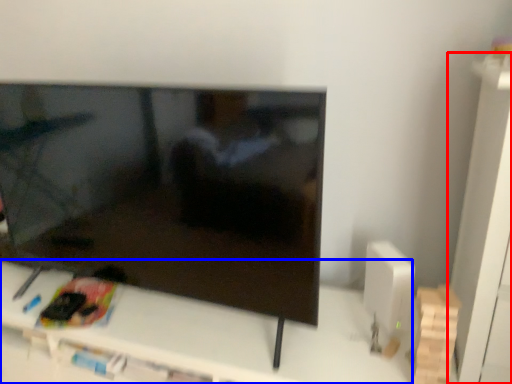
Question: Which point is further to the camera, tv cabinet (highlighted by a red box) or furniture (highlighted by a blue box)?

Choices:
 (A) tv cabinet
 (B) furniture

Answer: (B)